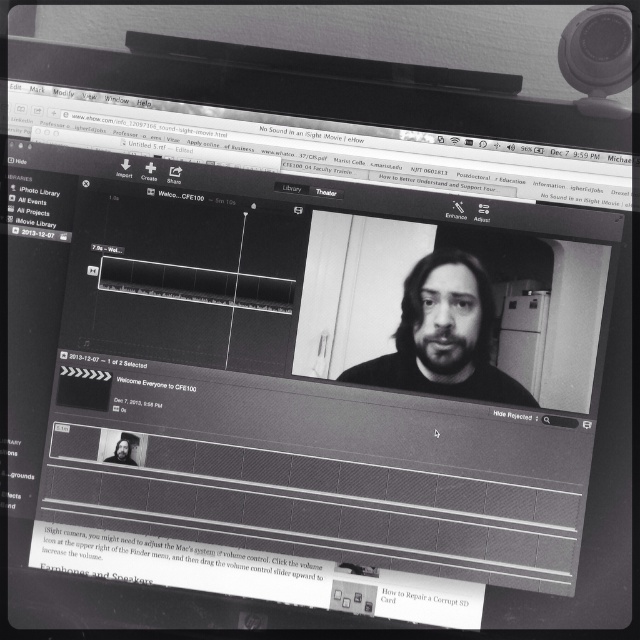
Does point (410, 380) come closer to viewer compared to point (128, 445)?

Yes.

In the scene shown: How far apart are black matte face at center and dark hair man at center?

black matte face at center is 13.66 inches away from dark hair man at center.

Where is `black matte face at center`? The image size is (640, 640). black matte face at center is located at coordinates (444, 336).

Identify the location of black matte face at center. pyautogui.click(x=444, y=336).